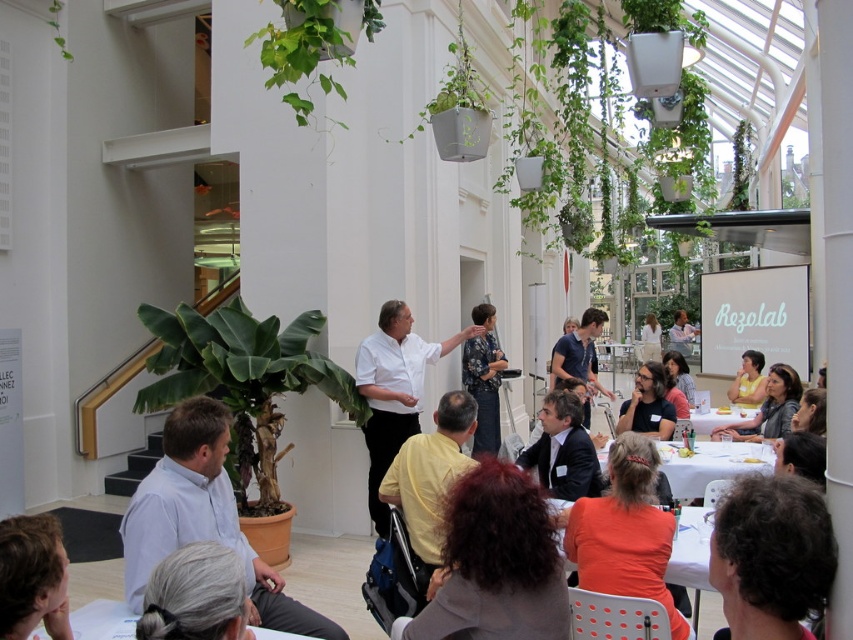
Question: Which point is farther to the camera?

Choices:
 (A) green matte plant at upper center
 (B) white matte shirt at center

Answer: (B)

Question: Which object appears farthest from the camera in this image?

Choices:
 (A) gray hair at lower left
 (B) yellow matte shirt at center
 (C) curly hair at center

Answer: (B)

Question: Is white matte shirt at center thinner than gray hair at lower left?

Choices:
 (A) yes
 (B) no

Answer: (B)

Question: In this image, where is white matte shirt at center located relative to white plastic table at center?

Choices:
 (A) below
 (B) above

Answer: (B)

Question: In this image, where is green leafy plant at lower left located relative to dark brown hair at center?

Choices:
 (A) below
 (B) above

Answer: (B)

Question: Which object appears closest to the camera in this image?

Choices:
 (A) dark brown hair at center
 (B) white plastic table at center
 (C) yellow matte shirt at center

Answer: (C)